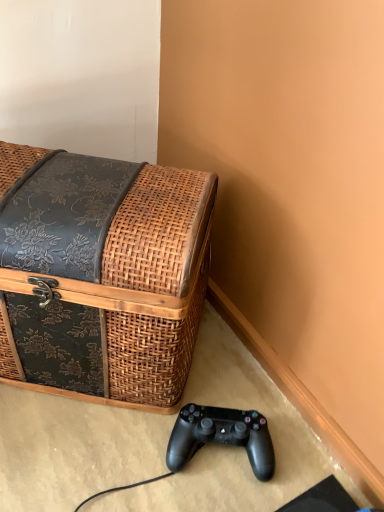
Question: Is woven wood trunk at left thinner than black matte game controller at lower center?

Choices:
 (A) yes
 (B) no

Answer: (B)

Question: From a real-world perspective, is woven wood trunk at left positioned under black matte game controller at lower center based on gravity?

Choices:
 (A) yes
 (B) no

Answer: (B)

Question: Can you confirm if woven wood trunk at left is positioned to the right of black matte game controller at lower center?

Choices:
 (A) no
 (B) yes

Answer: (A)

Question: Does woven wood trunk at left appear on the left side of black matte game controller at lower center?

Choices:
 (A) yes
 (B) no

Answer: (A)

Question: Is woven wood trunk at left not within black matte game controller at lower center?

Choices:
 (A) yes
 (B) no

Answer: (A)

Question: From the image's perspective, is woven wood trunk at left on black matte game controller at lower center?

Choices:
 (A) yes
 (B) no

Answer: (A)

Question: Can you confirm if black matte game controller at lower center is smaller than woven wood trunk at left?

Choices:
 (A) no
 (B) yes

Answer: (B)

Question: Considering the relative positions of black matte game controller at lower center and woven wood trunk at left in the image provided, is black matte game controller at lower center to the left of woven wood trunk at left from the viewer's perspective?

Choices:
 (A) no
 (B) yes

Answer: (A)

Question: Does black matte game controller at lower center have a larger size compared to woven wood trunk at left?

Choices:
 (A) yes
 (B) no

Answer: (B)

Question: Is black matte game controller at lower center shorter than woven wood trunk at left?

Choices:
 (A) no
 (B) yes

Answer: (B)

Question: From the image's perspective, is black matte game controller at lower center over woven wood trunk at left?

Choices:
 (A) no
 (B) yes

Answer: (A)

Question: Does black matte game controller at lower center lie behind woven wood trunk at left?

Choices:
 (A) yes
 (B) no

Answer: (A)

Question: Do you think black matte game controller at lower center is within woven wood trunk at left, or outside of it?

Choices:
 (A) inside
 (B) outside

Answer: (B)